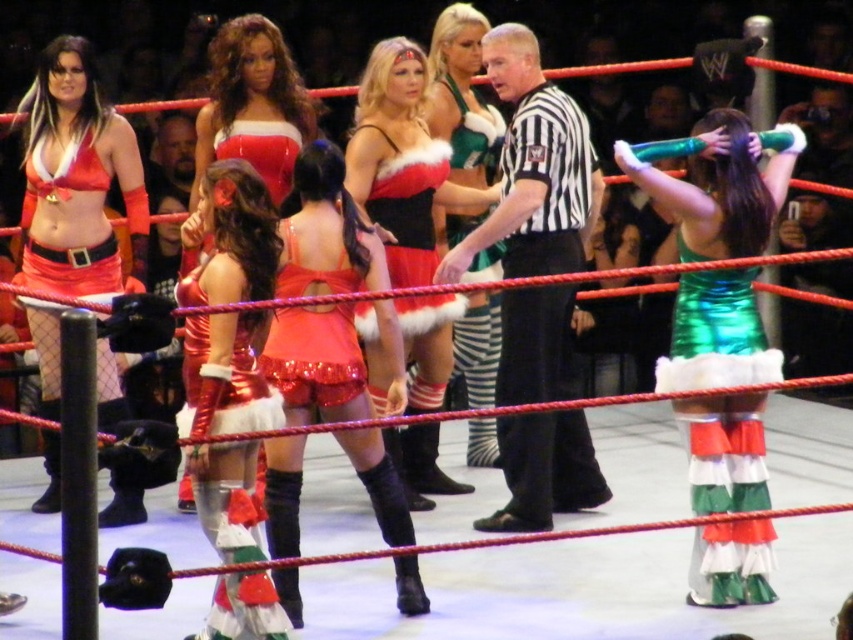
Does shiny satin dress at center have a greater height compared to green shiny dress at center?

Correct, shiny satin dress at center is much taller as green shiny dress at center.

Which is in front, point (402, 161) or point (486, 336)?

Point (402, 161) is more forward.

The image size is (853, 640). I want to click on shiny satin dress at center, so click(402, 163).

Between black striped shirt at center and matte red dress at left, which one is positioned higher?

matte red dress at left is above.

Can you confirm if black striped shirt at center is bigger than matte red dress at left?

Correct, black striped shirt at center is larger in size than matte red dress at left.

Is point (498, 394) farther from viewer compared to point (132, 516)?

No, (498, 394) is in front of (132, 516).

This screenshot has height=640, width=853. Find the location of `black striped shirt at center`. black striped shirt at center is located at coordinates (532, 170).

Is black striped shirt at center thinner than shiny metallic skirt at center?

In fact, black striped shirt at center might be wider than shiny metallic skirt at center.

Between black striped shirt at center and shiny metallic skirt at center, which one appears on the right side from the viewer's perspective?

black striped shirt at center

Which is in front, point (514, 360) or point (247, 536)?

Positioned in front is point (247, 536).

Where is `black striped shirt at center`? The image size is (853, 640). black striped shirt at center is located at coordinates pos(532,170).